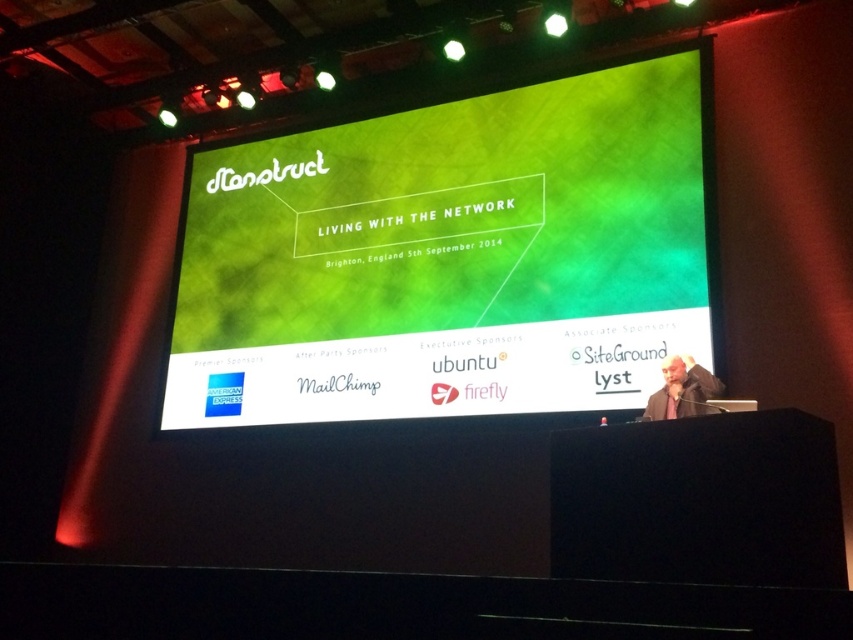
Which is below, green matte projection screen at center or dark gray jacket at lower right?

Positioned lower is dark gray jacket at lower right.

Image resolution: width=853 pixels, height=640 pixels. Find the location of `green matte projection screen at center`. green matte projection screen at center is located at coordinates (453, 257).